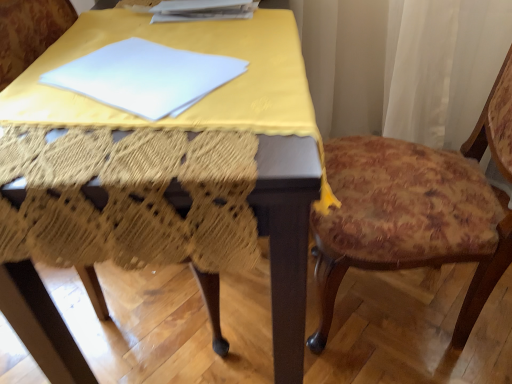
Question: From the image's perspective, is floral fabric cushion at right located above white paper at upper center?

Choices:
 (A) no
 (B) yes

Answer: (A)

Question: From a real-world perspective, is floral fabric cushion at right on top of white paper at upper center?

Choices:
 (A) yes
 (B) no

Answer: (B)

Question: Is floral fabric cushion at right positioned behind white paper at upper center?

Choices:
 (A) yes
 (B) no

Answer: (B)

Question: Can you see floral fabric cushion at right touching white paper at upper center?

Choices:
 (A) yes
 (B) no

Answer: (B)

Question: From a real-world perspective, is floral fabric cushion at right located beneath white paper at upper center?

Choices:
 (A) yes
 (B) no

Answer: (A)

Question: In terms of width, does yellow fabric-covered table at center look wider or thinner when compared to floral fabric cushion at right?

Choices:
 (A) wide
 (B) thin

Answer: (A)

Question: Does point (211, 122) appear closer or farther from the camera than point (438, 170)?

Choices:
 (A) farther
 (B) closer

Answer: (B)

Question: Do you think yellow fabric-covered table at center is within floral fabric cushion at right, or outside of it?

Choices:
 (A) outside
 (B) inside

Answer: (A)

Question: Would you say yellow fabric-covered table at center is to the left or to the right of floral fabric cushion at right in the picture?

Choices:
 (A) right
 (B) left

Answer: (B)

Question: Relative to white paper at upper center, is floral fabric cushion at right in front or behind?

Choices:
 (A) behind
 (B) front

Answer: (B)

Question: Looking at their shapes, would you say floral fabric cushion at right is wider or thinner than white paper at upper center?

Choices:
 (A) wide
 (B) thin

Answer: (A)

Question: Is point (353, 231) positioned closer to the camera than point (202, 8)?

Choices:
 (A) farther
 (B) closer

Answer: (B)

Question: From a real-world perspective, relative to white paper at upper center, is floral fabric cushion at right vertically above or below?

Choices:
 (A) above
 (B) below

Answer: (B)

Question: Is white paper at upper center inside the boundaries of yellow fabric-covered table at center, or outside?

Choices:
 (A) inside
 (B) outside

Answer: (A)

Question: From a real-world perspective, relative to yellow fabric-covered table at center, is white paper at upper center vertically above or below?

Choices:
 (A) above
 (B) below

Answer: (A)